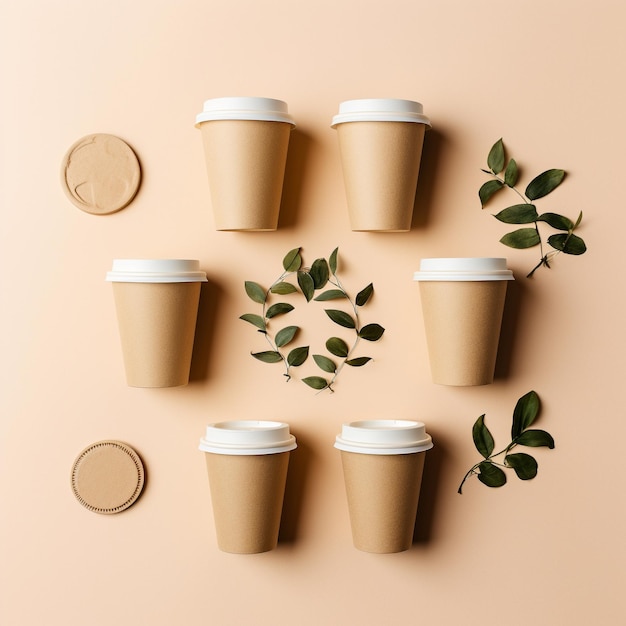
Where is `cups on their side`? This screenshot has height=626, width=626. cups on their side is located at coordinates (382, 501), (279, 485), (463, 313), (135, 285), (379, 165), (249, 203).